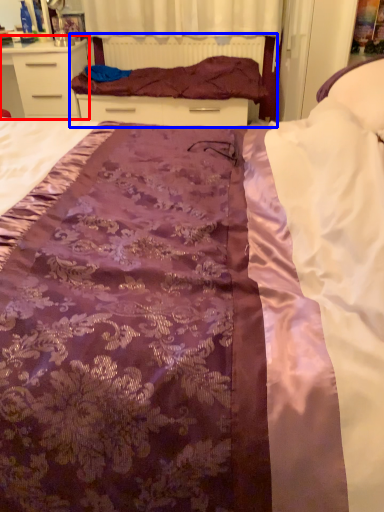
Question: Which of the following is the closest to the observer, chest of drawers (highlighted by a red box) or bed frame (highlighted by a blue box)?

Choices:
 (A) chest of drawers
 (B) bed frame

Answer: (A)